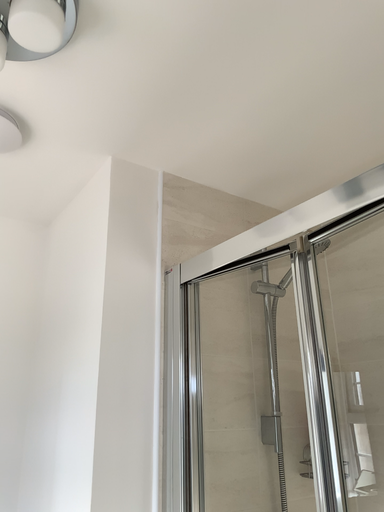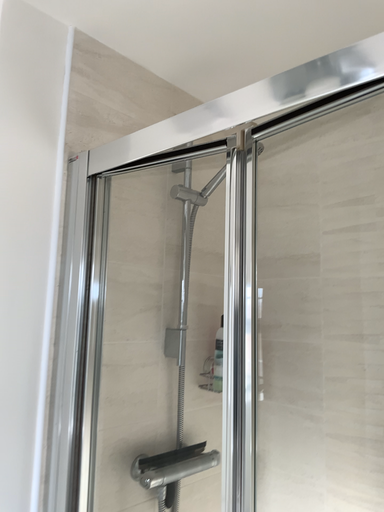
Question: How did the camera likely rotate when shooting the video?

Choices:
 (A) rotated left
 (B) rotated right

Answer: (B)